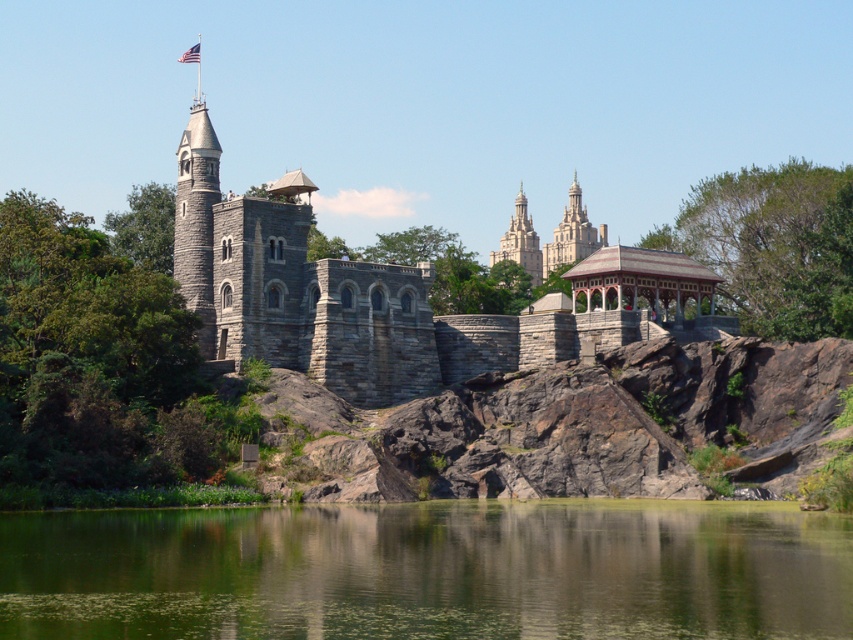
Question: Does green reflective water at center have a greater width compared to light gray stone tower at center?

Choices:
 (A) no
 (B) yes

Answer: (B)

Question: Can you confirm if wooden gazebo at center is smaller than light gray stone tower at center?

Choices:
 (A) yes
 (B) no

Answer: (A)

Question: Which point appears closest to the camera in this image?

Choices:
 (A) tap(195, 60)
 (B) tap(521, 225)

Answer: (B)

Question: Which point appears farthest from the camera in this image?

Choices:
 (A) (196, 45)
 (B) (614, 252)
 (C) (520, 182)
 (D) (735, 545)

Answer: (A)

Question: Does wooden gazebo at center have a greater width compared to american flag at upper center?

Choices:
 (A) yes
 (B) no

Answer: (A)

Question: Which of the following is the farthest from the observer?

Choices:
 (A) light gray stone tower at center
 (B) american flag at upper center
 (C) green reflective water at center

Answer: (B)